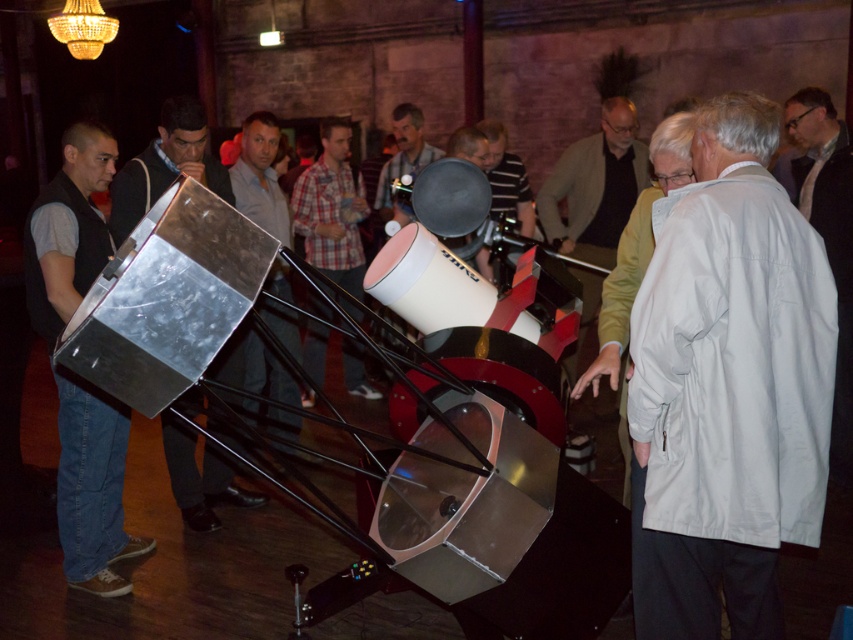
Does metallic vest at left appear on the right side of metallic silver telescope at left?

No, metallic vest at left is not to the right of metallic silver telescope at left.

Who is more forward, (82, 529) or (119, 237)?

Point (82, 529)

Does point (120, 548) lie in front of point (131, 164)?

Yes, point (120, 548) is closer to viewer.

Identify the location of metallic vest at left. (91, 488).

Can you confirm if white fabric coat at right is wider than brushed metal telescope at center?

Incorrect, white fabric coat at right's width does not surpass brushed metal telescope at center's.

Which is below, white fabric coat at right or brushed metal telescope at center?

brushed metal telescope at center is below.

Where is `white fabric coat at right`? The image size is (853, 640). white fabric coat at right is located at coordinates (828, 236).

The image size is (853, 640). I want to click on white fabric coat at right, so click(x=828, y=236).

Does point (154, 163) come farther from viewer compared to point (305, 212)?

That is False.

The image size is (853, 640). In order to click on metallic silver telescope at left in this screenshot , I will do `click(166, 164)`.